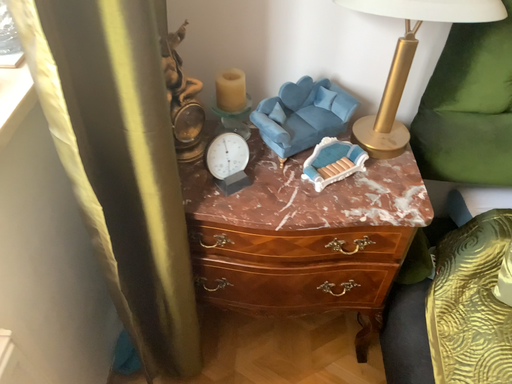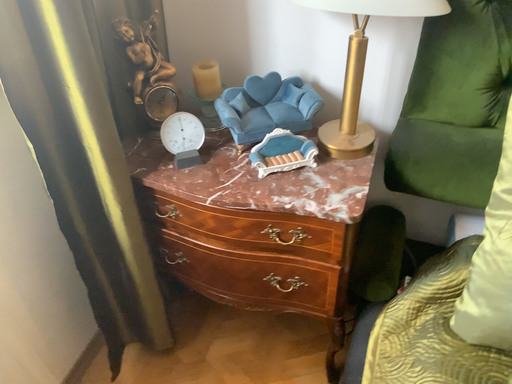
Question: Which way did the camera rotate in the video?

Choices:
 (A) rotated upward
 (B) rotated downward

Answer: (A)